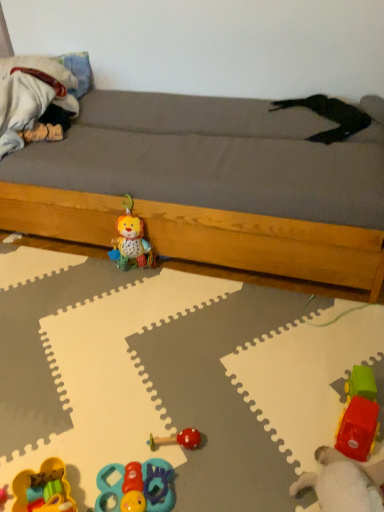
This screenshot has height=512, width=384. Find the location of `free space to the back side of rubberized plastic car at lower right, the fifth toy when ordered from left to right`. free space to the back side of rubberized plastic car at lower right, the fifth toy when ordered from left to right is located at coordinates (287, 396).